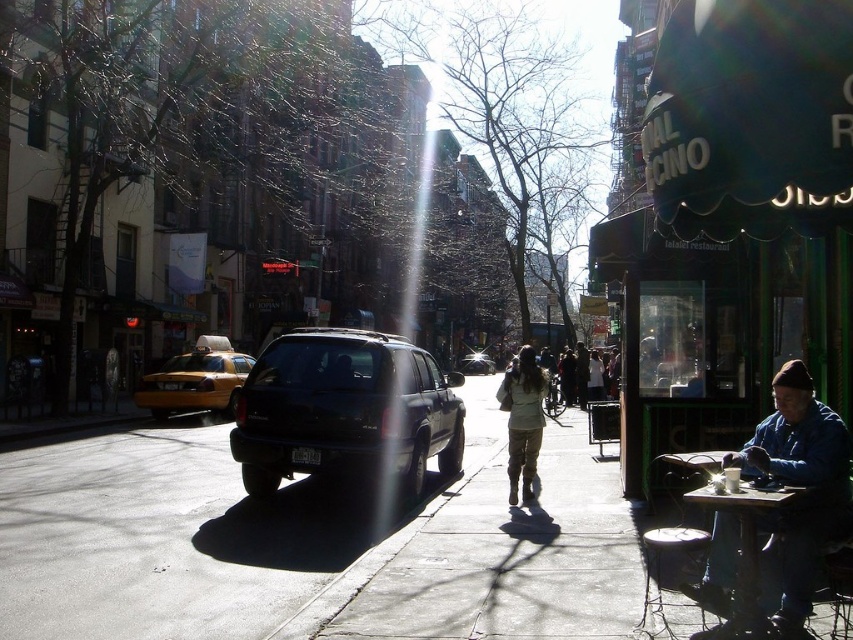
You are standing on the sidewalk and want to walk to both the point at coordinates point (250, 433) and the point at coordinates point (532, 464). Which point will you reach first?

You will reach the point at coordinates point (250, 433) first because it is closer to you than the point at coordinates point (532, 464).

You are standing at the corner of the street and want to walk to the dark asphalt pavement at center. According to the scene description, which direction should you head towards?

The dark asphalt pavement at center is located at point (160, 540), so you should head towards the coordinates provided to reach it.